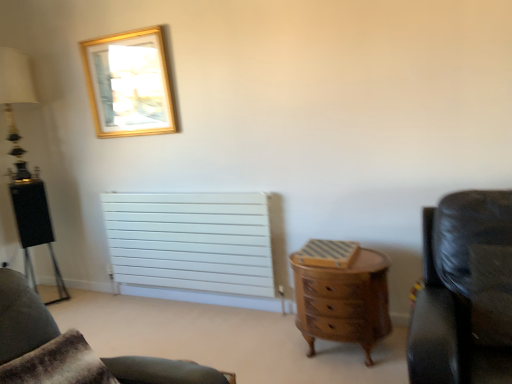
Question: Is black leather chair at right, the 1th chair viewed from the front, positioned in front of white matte radiator at center?

Choices:
 (A) yes
 (B) no

Answer: (A)

Question: Is black leather chair at right, which is counted as the first chair, starting from the top, far from white matte radiator at center?

Choices:
 (A) no
 (B) yes

Answer: (B)

Question: Is black leather chair at right, placed as the 2th chair when sorted from back to front, taller than white matte radiator at center?

Choices:
 (A) yes
 (B) no

Answer: (B)

Question: From the image's perspective, is black leather chair at right, the 2th chair viewed from the left, above white matte radiator at center?

Choices:
 (A) no
 (B) yes

Answer: (B)

Question: From a real-world perspective, is black leather chair at right, placed as the 2th chair when sorted from back to front, located beneath white matte radiator at center?

Choices:
 (A) no
 (B) yes

Answer: (A)

Question: Based on their sizes in the image, would you say white matte radiator at center is bigger or smaller than black leather chair at right, which is counted as the first chair, starting from the top?

Choices:
 (A) small
 (B) big

Answer: (B)

Question: Considering the positions of point (115, 253) and point (480, 367), is point (115, 253) closer or farther from the camera than point (480, 367)?

Choices:
 (A) farther
 (B) closer

Answer: (A)

Question: From the image's perspective, is white matte radiator at center positioned above or below black leather chair at right, placed as the 2th chair when sorted from back to front?

Choices:
 (A) below
 (B) above

Answer: (A)

Question: From a real-world perspective, is white matte radiator at center physically located above or below black leather chair at right, the 2th chair viewed from the left?

Choices:
 (A) below
 (B) above

Answer: (A)

Question: Looking at their shapes, would you say black leather chair at right, which appears as the 1th chair when viewed from the right, is wider or thinner than gold metallic picture frame at upper left?

Choices:
 (A) thin
 (B) wide

Answer: (B)

Question: From a real-world perspective, is black leather chair at right, the 1th chair viewed from the front, above or below gold metallic picture frame at upper left?

Choices:
 (A) below
 (B) above

Answer: (A)

Question: Considering the positions of black leather chair at right, the 2th chair positioned from the bottom, and gold metallic picture frame at upper left in the image, is black leather chair at right, the 2th chair positioned from the bottom, bigger or smaller than gold metallic picture frame at upper left?

Choices:
 (A) big
 (B) small

Answer: (A)

Question: Considering the relative positions of black leather chair at right, the 2th chair viewed from the left, and gold metallic picture frame at upper left in the image provided, is black leather chair at right, the 2th chair viewed from the left, to the left or to the right of gold metallic picture frame at upper left?

Choices:
 (A) left
 (B) right

Answer: (B)

Question: Relative to wooden chest of drawers at center, is gold metallic picture frame at upper left in front or behind?

Choices:
 (A) behind
 (B) front

Answer: (A)

Question: From the image's perspective, is gold metallic picture frame at upper left above or below wooden chest of drawers at center?

Choices:
 (A) above
 (B) below

Answer: (A)